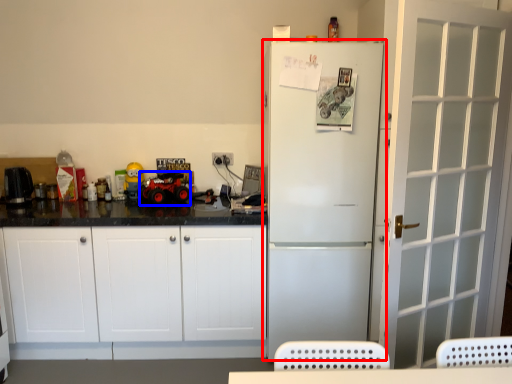
Question: Which object is closer to the camera taking this photo, refrigerator (highlighted by a red box) or toy car (highlighted by a blue box)?

Choices:
 (A) refrigerator
 (B) toy car

Answer: (A)